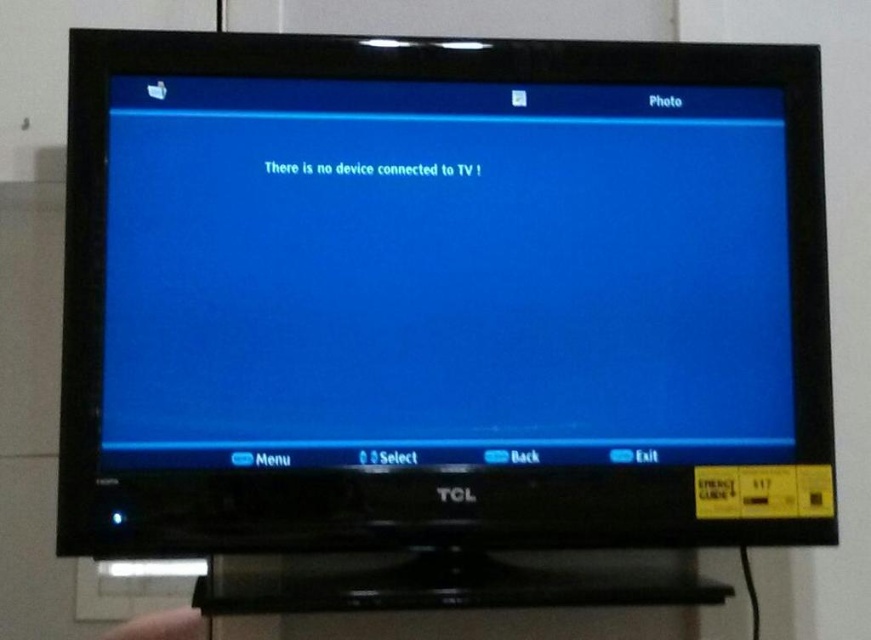
Question: Can you confirm if blue glossy screen at center is smaller than skinny flesh hand at lower left?

Choices:
 (A) yes
 (B) no

Answer: (B)

Question: Which point is closer to the camera?

Choices:
 (A) (171, 628)
 (B) (478, 298)

Answer: (B)

Question: Is blue glossy screen at center to the left of skinny flesh hand at lower left from the viewer's perspective?

Choices:
 (A) yes
 (B) no

Answer: (B)

Question: Which point is farther to the camera?

Choices:
 (A) skinny flesh hand at lower left
 (B) blue glossy screen at center

Answer: (A)

Question: Which of the following is the closest to the observer?

Choices:
 (A) blue glossy screen at center
 (B) skinny flesh hand at lower left

Answer: (A)

Question: Does blue glossy screen at center appear over skinny flesh hand at lower left?

Choices:
 (A) no
 (B) yes

Answer: (B)